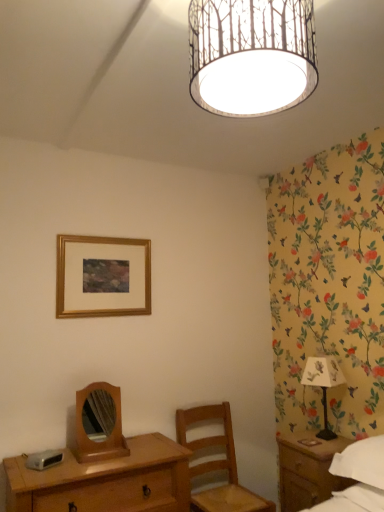
Locate an element on the screen. white cotton bed at lower right is located at coordinates (358, 477).

Image resolution: width=384 pixels, height=512 pixels. Find the location of `gold wooden picture frame at upper center`. gold wooden picture frame at upper center is located at coordinates (102, 276).

The image size is (384, 512). Find the location of `white cotton bed at lower right`. white cotton bed at lower right is located at coordinates [x=358, y=477].

Is wooden chair at center facing towards white cotton bed at lower right?

Yes, wooden chair at center is oriented towards white cotton bed at lower right.

Who is taller, wooden chair at center or white cotton bed at lower right?

Standing taller between the two is wooden chair at center.

How many degrees apart are the facing directions of wooden chair at center and white cotton bed at lower right?

89.7 degrees.

From a real-world perspective, is wooden chair at center positioned under white cotton bed at lower right based on gravity?

Correct, in the physical world, wooden chair at center is lower than white cotton bed at lower right.

Between wooden desk at lower left and white fabric lampshade at right, which one has larger width?

wooden desk at lower left.

Is wooden desk at lower left touching white fabric lampshade at right?

wooden desk at lower left is not next to white fabric lampshade at right, and they're not touching.

From the picture: From the image's perspective, which is below, wooden desk at lower left or white fabric lampshade at right?

wooden desk at lower left is shown below in the image.

Is wooden desk at lower left closer to the viewer compared to white fabric lampshade at right?

Yes, wooden desk at lower left is closer to the camera.

Is the surface of gold wooden picture frame at upper center in direct contact with white cotton bed at lower right?

No, gold wooden picture frame at upper center is not with white cotton bed at lower right.

In the image, is gold wooden picture frame at upper center positioned in front of or behind white cotton bed at lower right?

gold wooden picture frame at upper center is positioned farther from the viewer than white cotton bed at lower right.

Who is bigger, gold wooden picture frame at upper center or white cotton bed at lower right?

With larger size is white cotton bed at lower right.

Is gold wooden picture frame at upper center surrounded by wooden mirror at center?

Actually, gold wooden picture frame at upper center is outside wooden mirror at center.

Considering the sizes of wooden mirror at center and gold wooden picture frame at upper center in the image, is wooden mirror at center wider or thinner than gold wooden picture frame at upper center?

In the image, wooden mirror at center appears to be wider than gold wooden picture frame at upper center.

Which object is positioned more to the right, wooden mirror at center or gold wooden picture frame at upper center?

Positioned to the right is wooden mirror at center.

Consider the image. Based on their sizes in the image, would you say wooden mirror at center is bigger or smaller than gold wooden picture frame at upper center?

In the image, wooden mirror at center appears to be smaller than gold wooden picture frame at upper center.

From a real-world perspective, which is physically above, white cotton bed at lower right or wooden chair at center?

white cotton bed at lower right.

From the image's perspective, would you say white cotton bed at lower right is shown under wooden chair at center?

No, from the image's perspective, white cotton bed at lower right is not below wooden chair at center.

Is white cotton bed at lower right at the left side of wooden chair at center?

In fact, white cotton bed at lower right is to the right of wooden chair at center.

Can we say white cotton bed at lower right lies outside wooden chair at center?

Yes, white cotton bed at lower right is outside of wooden chair at center.

At what (x,y) coordinates should I click in order to perform the action: click on desk on the right of gold wooden picture frame at upper center. Please return your answer as a coordinate pair (x, y). This screenshot has height=512, width=384. Looking at the image, I should click on 105,481.

Is gold wooden picture frame at upper center at the right side of wooden desk at lower left?

No, gold wooden picture frame at upper center is not to the right of wooden desk at lower left.

Which of these two, gold wooden picture frame at upper center or wooden desk at lower left, is wider?

With larger width is wooden desk at lower left.

From a real-world perspective, which is physically above, gold wooden picture frame at upper center or wooden desk at lower left?

In real-world perspective, gold wooden picture frame at upper center is above.

From the image's perspective, which is above, gold wooden picture frame at upper center or white fabric lampshade at right?

gold wooden picture frame at upper center is shown above in the image.

Is gold wooden picture frame at upper center aimed at white fabric lampshade at right?

No, gold wooden picture frame at upper center is not turned towards white fabric lampshade at right.

Is gold wooden picture frame at upper center smaller than white fabric lampshade at right?

Yes, gold wooden picture frame at upper center is smaller than white fabric lampshade at right.

From a real-world perspective, is gold wooden picture frame at upper center positioned under white fabric lampshade at right based on gravity?

Incorrect, from a real-world perspective, gold wooden picture frame at upper center is higher than white fabric lampshade at right.

Locate an element on the screen. This screenshot has width=384, height=512. bed on the right side of wooden chair at center is located at coordinates (358, 477).

Where is `desk located below the white fabric lampshade at right (from the image's perspective)`? Image resolution: width=384 pixels, height=512 pixels. desk located below the white fabric lampshade at right (from the image's perspective) is located at coordinates (105, 481).

Estimate the real-world distances between objects in this image. Which object is closer to wooden chair at center, white cotton bed at lower right or white paper with tree pattern at upper center?

white cotton bed at lower right is positioned closer to the anchor wooden chair at center.

When comparing their distances from white paper with tree pattern at upper center, does wooden desk at lower left or white fabric lampshade at right seem further?

white fabric lampshade at right lies further to white paper with tree pattern at upper center than the other object.

Which object lies nearer to the anchor point wooden desk at lower left, white cotton bed at lower right or white fabric lampshade at right?

Among the two, white cotton bed at lower right is located nearer to wooden desk at lower left.

Based on their spatial positions, is wooden chair at center or white fabric lampshade at right further from wooden desk at lower left?

white fabric lampshade at right is further to wooden desk at lower left.

Which object lies nearer to the anchor point wooden desk at lower left, wooden mirror at center or white cotton bed at lower right?

wooden mirror at center is positioned closer to the anchor wooden desk at lower left.

In the scene shown: Estimate the real-world distances between objects in this image. Which object is closer to wooden mirror at center, white cotton bed at lower right or wooden chair at center?

wooden chair at center is positioned closer to the anchor wooden mirror at center.

Which object lies further to the anchor point white cotton bed at lower right, gold wooden picture frame at upper center or wooden mirror at center?

Based on the image, gold wooden picture frame at upper center appears to be further to white cotton bed at lower right.

Based on their spatial positions, is gold wooden picture frame at upper center or white paper with tree pattern at upper center closer to white fabric lampshade at right?

Among the two, gold wooden picture frame at upper center is located nearer to white fabric lampshade at right.

Where is `mirror between white paper with tree pattern at upper center and white cotton bed at lower right in the vertical direction`? This screenshot has height=512, width=384. mirror between white paper with tree pattern at upper center and white cotton bed at lower right in the vertical direction is located at coordinates click(105, 440).

I want to click on mirror located between white paper with tree pattern at upper center and gold wooden picture frame at upper center in the depth direction, so click(x=105, y=440).

Find the location of `table lamp between white paper with tree pattern at upper center and wooden desk at lower left in the up-down direction`. table lamp between white paper with tree pattern at upper center and wooden desk at lower left in the up-down direction is located at coordinates (323, 384).

Find the location of `bed between white paper with tree pattern at upper center and wooden chair at center in the vertical direction`. bed between white paper with tree pattern at upper center and wooden chair at center in the vertical direction is located at coordinates (358, 477).